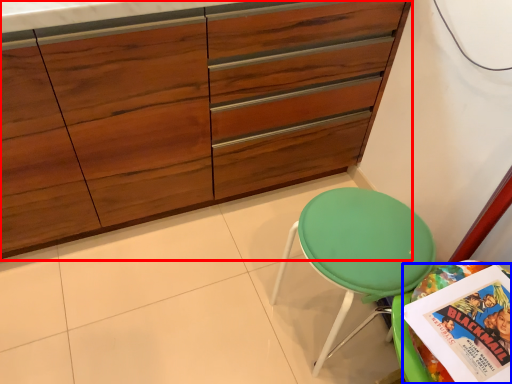
Question: Which of the following is the closest to the observer, cabinetry (highlighted by a red box) or comic book (highlighted by a blue box)?

Choices:
 (A) cabinetry
 (B) comic book

Answer: (B)